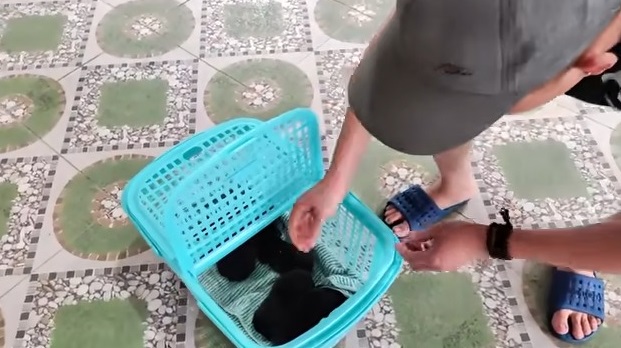
Find the location of `tiles`. tiles is located at coordinates (30, 212), (134, 117), (23, 17), (264, 53), (116, 303), (324, 92), (528, 158), (453, 320).